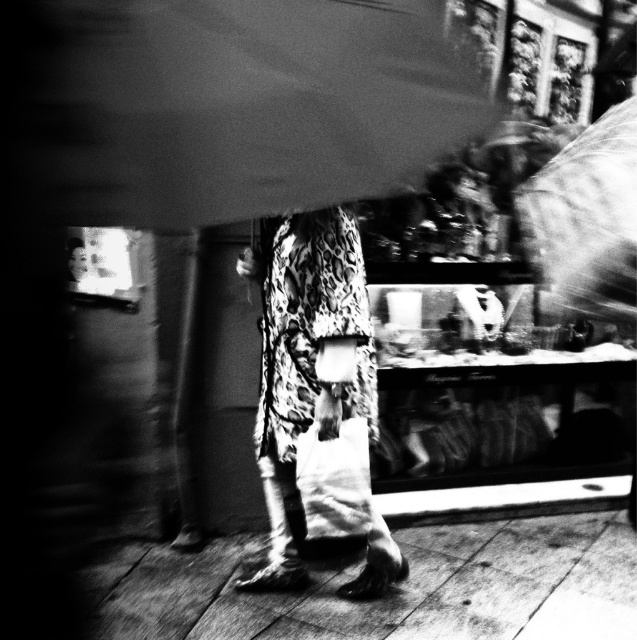
Question: Which object is positioned farthest from the transparent plastic umbrella at upper right?

Choices:
 (A) smooth fabric umbrella at upper center
 (B) smooth wooden floor at lower center

Answer: (B)

Question: Is smooth wooden floor at lower center in front of transparent plastic umbrella at upper right?

Choices:
 (A) yes
 (B) no

Answer: (B)

Question: Is leopard print dress at center above transparent plastic umbrella at upper right?

Choices:
 (A) yes
 (B) no

Answer: (B)

Question: From the image, what is the correct spatial relationship of smooth fabric umbrella at upper center in relation to smooth wooden floor at lower center?

Choices:
 (A) right
 (B) left

Answer: (B)

Question: Which of the following is the closest to the observer?

Choices:
 (A) (225, 602)
 (B) (283, 307)
 (C) (352, 26)
 (D) (627, 125)

Answer: (C)

Question: Which object is the closest to the smooth wooden floor at lower center?

Choices:
 (A) leopard print dress at center
 (B) transparent plastic umbrella at upper right
 (C) smooth fabric umbrella at upper center

Answer: (A)